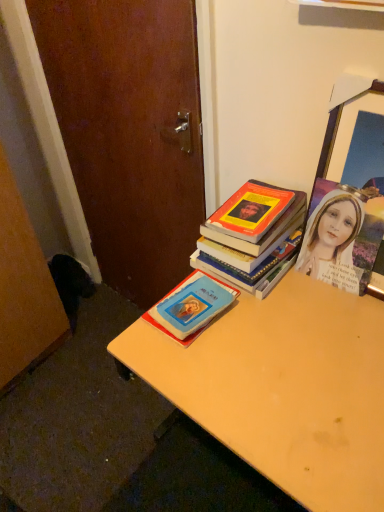
Locate an element on the screen. The width and height of the screenshot is (384, 512). vacant area that is in front of hardcover book at center, which is the second book from bottom to top is located at coordinates (x=284, y=324).